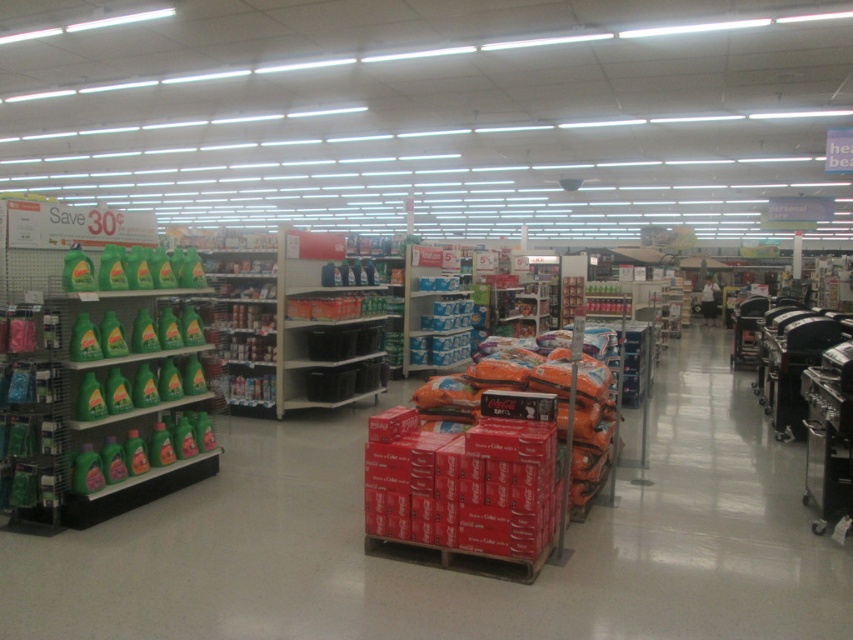
Which is behind, point (352, 289) or point (730, 353)?

Positioned behind is point (730, 353).

Is point (363, 356) behind point (746, 326)?

No, (363, 356) is in front of (746, 326).

Is point (308, 252) more distant than point (752, 342)?

No, (308, 252) is closer to viewer.

Locate an element on the screen. This screenshot has width=853, height=640. black plastic shelves at center is located at coordinates (329, 323).